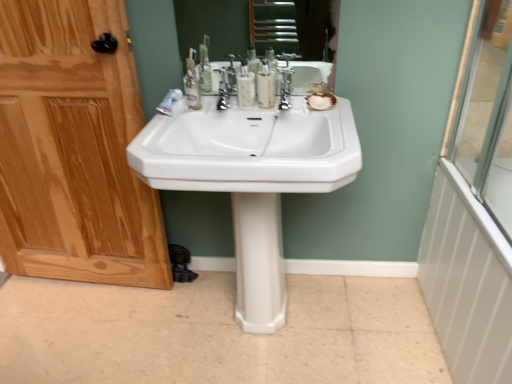
You are a GUI agent. You are given a task and a screenshot of the screen. Output one action in this format:
    pyautogui.click(x=<x>, y=<y>)
    Task: Click on the free space in front of wooden door at left
    The image size is (512, 384).
    Given the screenshot: What is the action you would take?
    pyautogui.click(x=74, y=332)